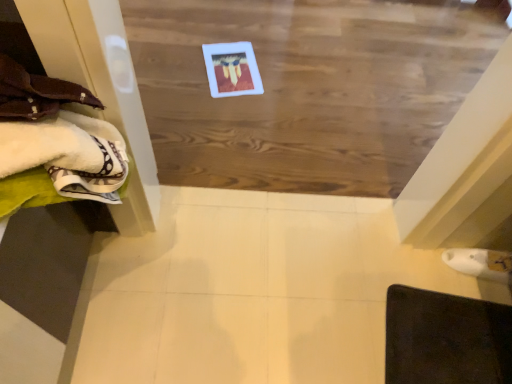
The height and width of the screenshot is (384, 512). Identify the location of empty space that is ontop of white soft towels at left. (45, 87).